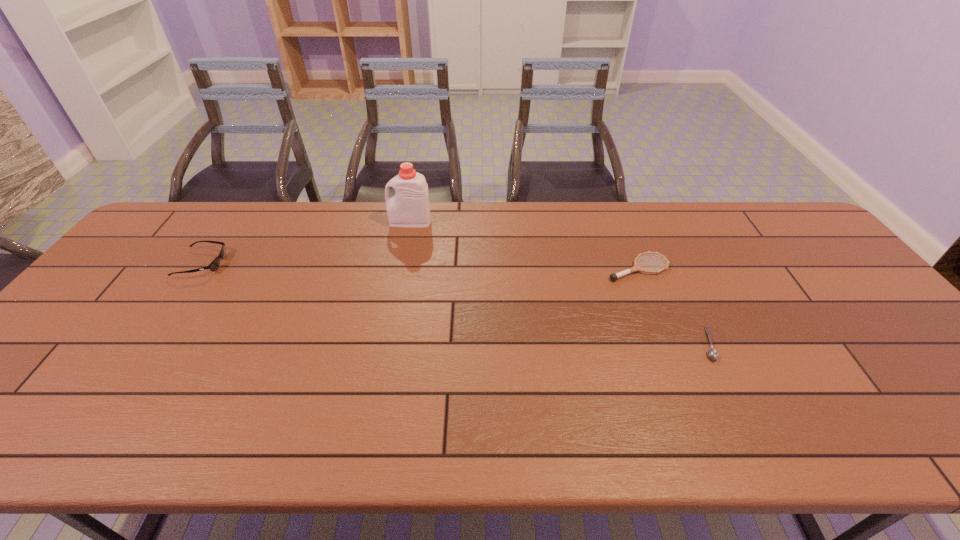
The height and width of the screenshot is (540, 960). What are the coordinates of `free space that satisfies the following two spatial constraints: 1. on the handle side of the tallest object; 2. on the left side of the third tallest object` in the screenshot? It's located at (401, 268).

What are the coordinates of `free location that satisfies the following two spatial constraints: 1. on the handle side of the farthest object; 2. on the right side of the shortest object` in the screenshot? It's located at (386, 344).

The height and width of the screenshot is (540, 960). I want to click on vacant area that satisfies the following two spatial constraints: 1. on the handle side of the shortest object; 2. on the left side of the detergent, so click(386, 344).

Locate an element on the screen. Image resolution: width=960 pixels, height=540 pixels. vacant space that satisfies the following two spatial constraints: 1. on the front-facing side of the leftmost object; 2. on the back side of the second shortest object is located at coordinates (199, 268).

What are the coordinates of `vacant space that satisfies the following two spatial constraints: 1. on the back side of the tennis racket; 2. on the handle side of the second object from left to right` in the screenshot? It's located at pyautogui.click(x=619, y=222).

The width and height of the screenshot is (960, 540). I want to click on free location that satisfies the following two spatial constraints: 1. on the handle side of the tallest object; 2. on the left side of the second shortest object, so click(401, 268).

This screenshot has width=960, height=540. I want to click on free space that satisfies the following two spatial constraints: 1. on the handle side of the farthest object; 2. on the back side of the shortest object, so click(x=386, y=344).

The width and height of the screenshot is (960, 540). In order to click on free region that satisfies the following two spatial constraints: 1. on the handle side of the tallest object; 2. on the left side of the nearest object in this screenshot , I will do `click(386, 344)`.

Identify the location of vacant space that satisfies the following two spatial constraints: 1. on the front-facing side of the soupspoon; 2. on the right side of the sunglasses. (146, 344).